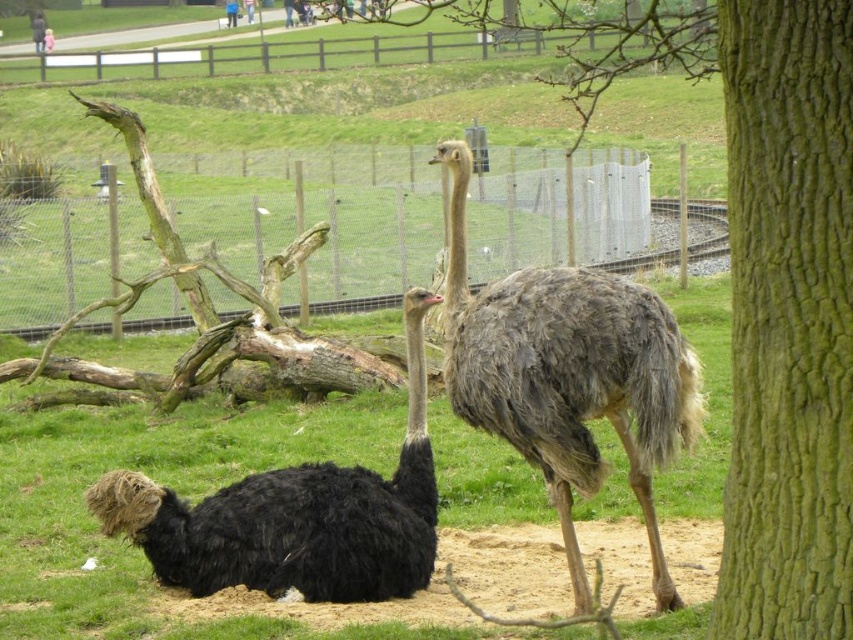
Question: Does green rough bark tree at center right have a greater width compared to green rough bark tree trunk at right?

Choices:
 (A) no
 (B) yes

Answer: (B)

Question: Considering the relative positions of metallic wire fence at upper center and brown feathered ostrich at center in the image provided, where is metallic wire fence at upper center located with respect to brown feathered ostrich at center?

Choices:
 (A) left
 (B) right

Answer: (A)

Question: Among these points, which one is farthest from the camera?

Choices:
 (A) (811, 321)
 (B) (397, 244)
 (C) (850, 262)
 (D) (219, 572)

Answer: (B)

Question: Which point is closer to the camera taking this photo?

Choices:
 (A) (724, 116)
 (B) (811, 467)
 (C) (585, 236)

Answer: (B)

Question: Is green rough bark tree at center right above green grass at center?

Choices:
 (A) no
 (B) yes

Answer: (B)

Question: Based on their relative distances, which object is farther from the black feathered ostrich at lower left?

Choices:
 (A) green rough bark tree trunk at right
 (B) brown feathered ostrich at center
 (C) green rough bark tree at center right
 (D) green grass at center

Answer: (C)